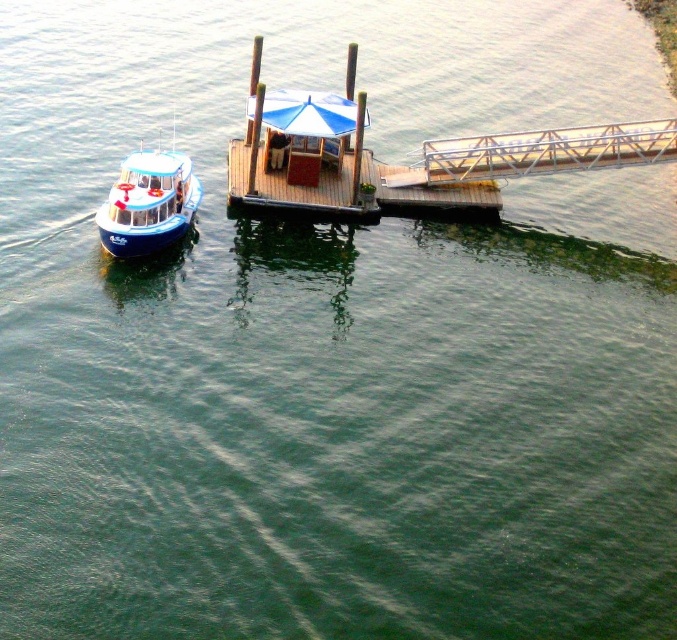
Measure the distance between metallic gray dock at upper right and blue glossy boat at left.

metallic gray dock at upper right is 11.77 meters away from blue glossy boat at left.

Does point (634, 125) come farther from viewer compared to point (169, 243)?

Yes, it is.

Where is `metallic gray dock at upper right`? The image size is (677, 640). metallic gray dock at upper right is located at coordinates (546, 150).